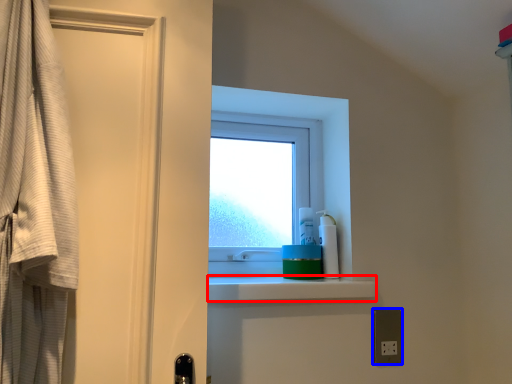
Question: Which object is further to the camera taking this photo, balustrade (highlighted by a red box) or electric outlet (highlighted by a blue box)?

Choices:
 (A) balustrade
 (B) electric outlet

Answer: (B)